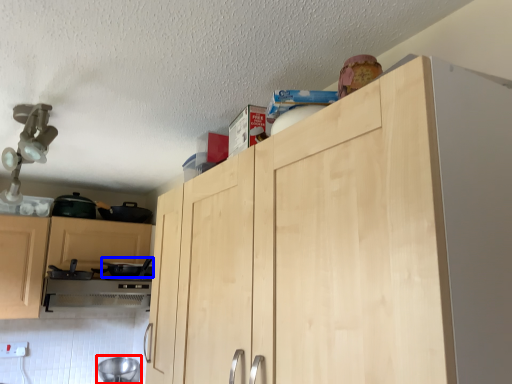
Question: Which object is closer to the camera taking this photo, appliance (highlighted by a red box) or appliance (highlighted by a blue box)?

Choices:
 (A) appliance
 (B) appliance

Answer: (B)